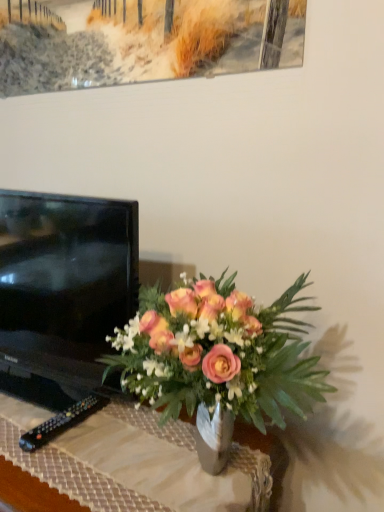
The height and width of the screenshot is (512, 384). What are the coordinates of `blank area to the left of black plastic remote at lower left` in the screenshot? It's located at (20, 418).